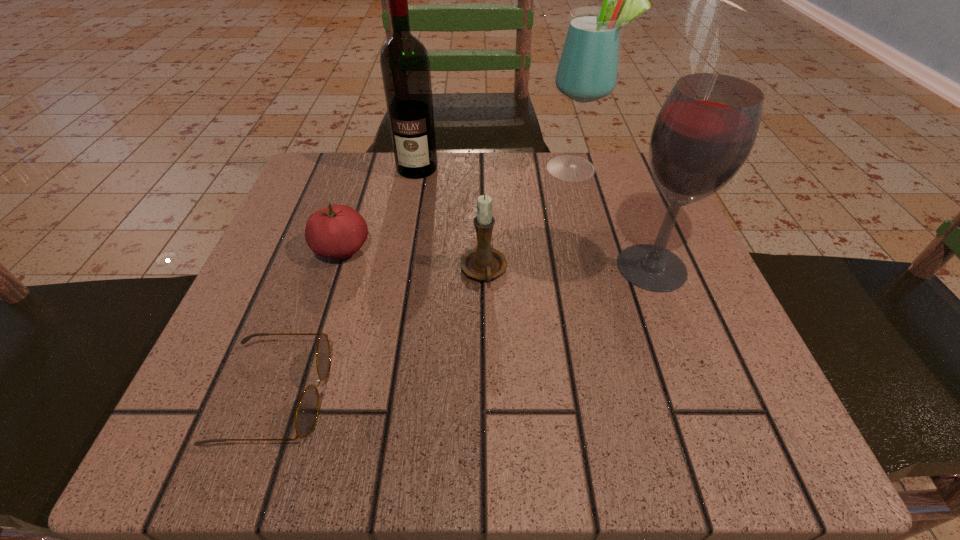
Locate an element on the screen. The width and height of the screenshot is (960, 540). the fourth object from right to left is located at coordinates (405, 65).

Image resolution: width=960 pixels, height=540 pixels. Identify the location of the nearest alcohol. click(706, 129).

Image resolution: width=960 pixels, height=540 pixels. I want to click on the third tallest object, so click(706, 129).

Identify the location of the third object from right to left. (485, 263).

I want to click on the fourth tallest object, so click(485, 263).

Find the location of a particular element. This screenshot has height=540, width=960. tomato is located at coordinates (338, 231).

Where is `sunglasses`? This screenshot has height=540, width=960. sunglasses is located at coordinates (307, 411).

Where is `the nearest object`? The height and width of the screenshot is (540, 960). the nearest object is located at coordinates (307, 411).

Where is `vacant space located on the front and back of the leftmost alcohol`? The height and width of the screenshot is (540, 960). vacant space located on the front and back of the leftmost alcohol is located at coordinates (407, 222).

Image resolution: width=960 pixels, height=540 pixels. What are the coordinates of `vacant space located on the left of the shortest alcohol` in the screenshot? It's located at (420, 267).